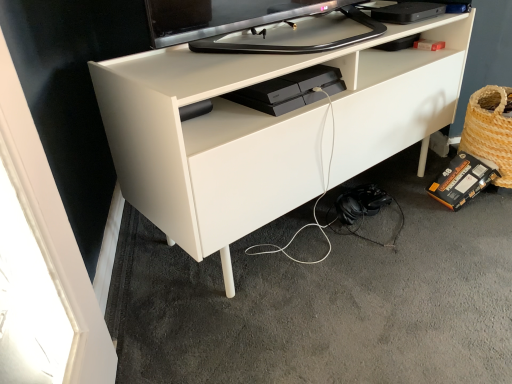
You are a GUI agent. You are given a task and a screenshot of the screen. Output one action in this format:
    pyautogui.click(x=<x>, y=<y>)
    Task: Click on the free point above black matte headphones at lower right (from a real-world perspective)
    
    Given the screenshot: What is the action you would take?
    337,268